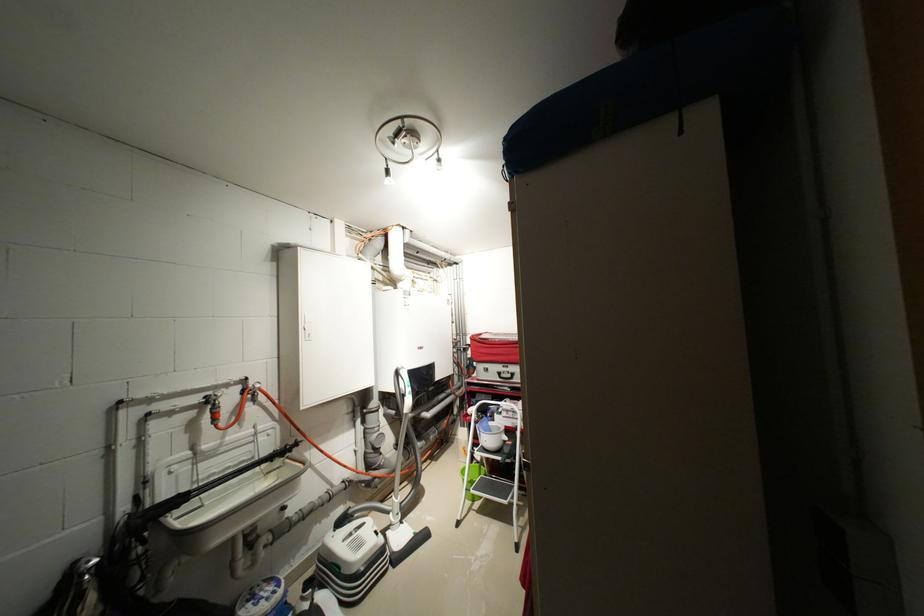
Identify the location of upright vacuum handle. (402, 484).